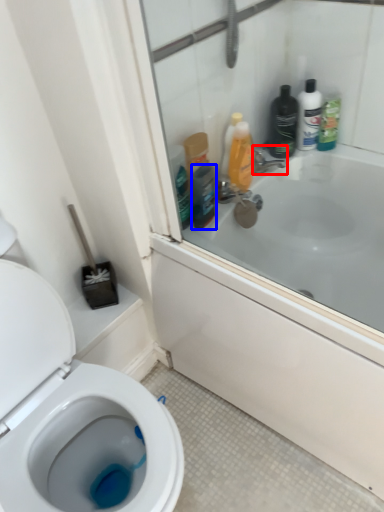
Question: Among these objects, which one is nearest to the camera, tap (highlighted by a red box) or mouthwash (highlighted by a blue box)?

Choices:
 (A) tap
 (B) mouthwash

Answer: (B)